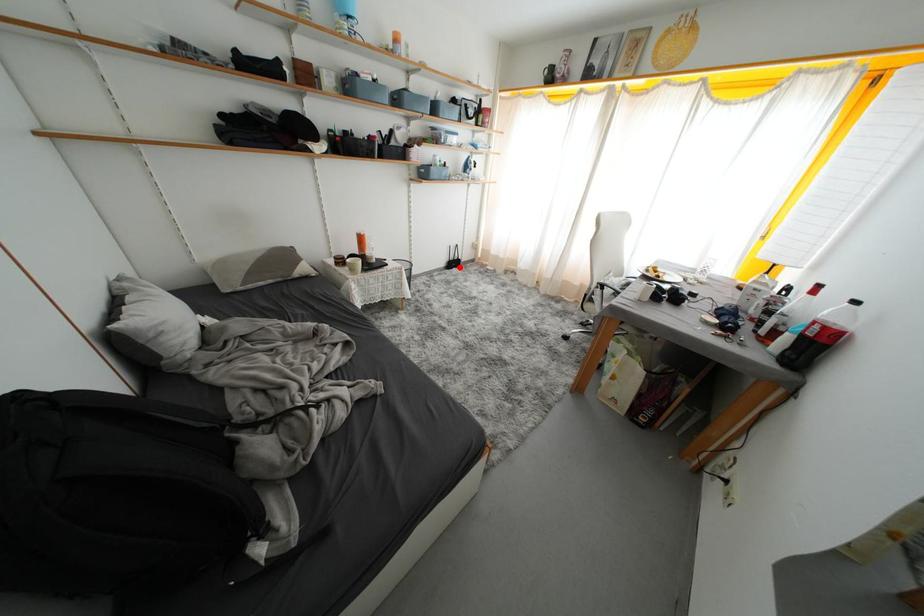
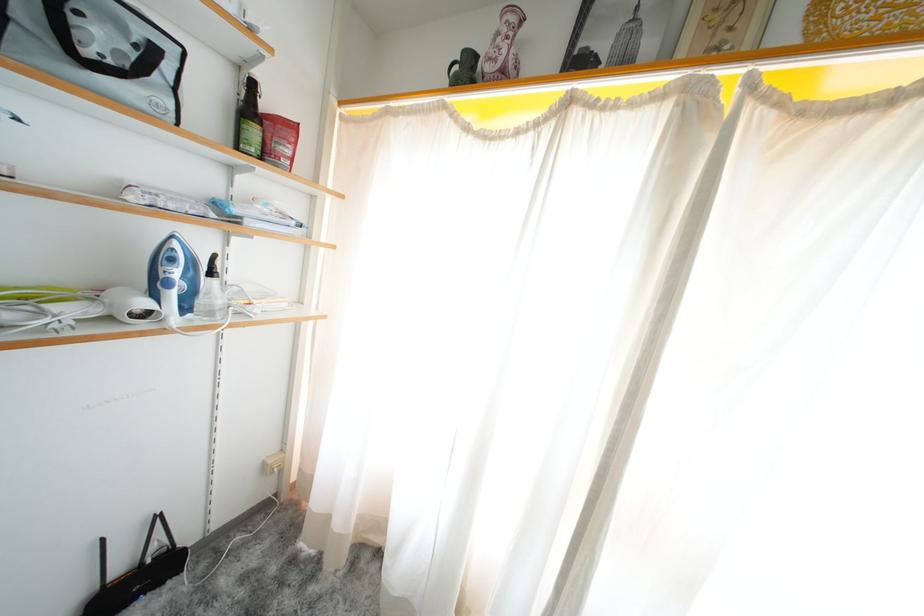
Find the pixel in the second image that matches the highlighted location in the first image.

(143, 586)